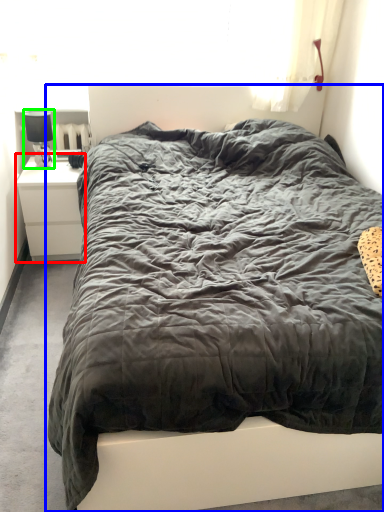
Question: Based on their relative distances, which object is farther from nightstand (highlighted by a red box)? Choose from bed (highlighted by a blue box) and lamp (highlighted by a green box).

Choices:
 (A) bed
 (B) lamp

Answer: (A)